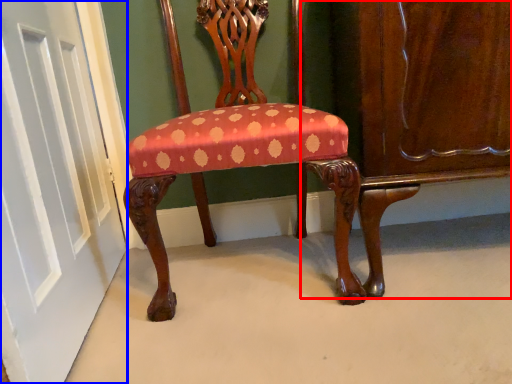
Question: Which object is closer to the camera taking this photo, dresser (highlighted by a red box) or door (highlighted by a blue box)?

Choices:
 (A) dresser
 (B) door

Answer: (B)